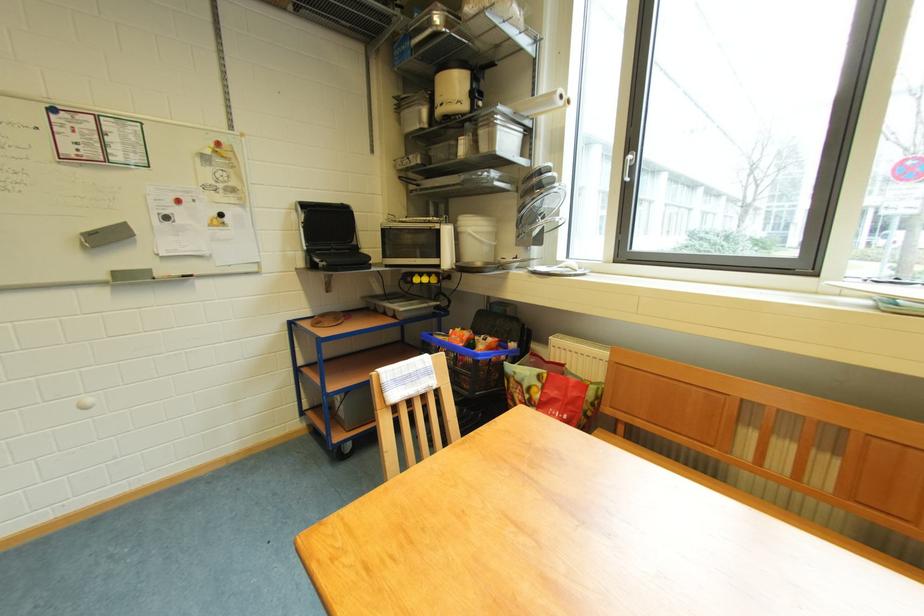
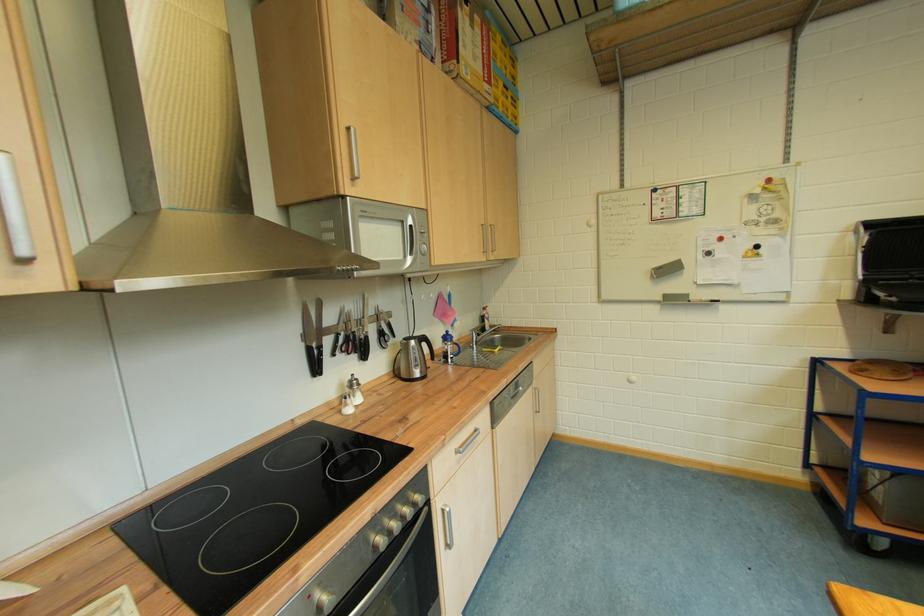
Find the pixel in the second image that matches (324,329) in the first image.

(868, 377)